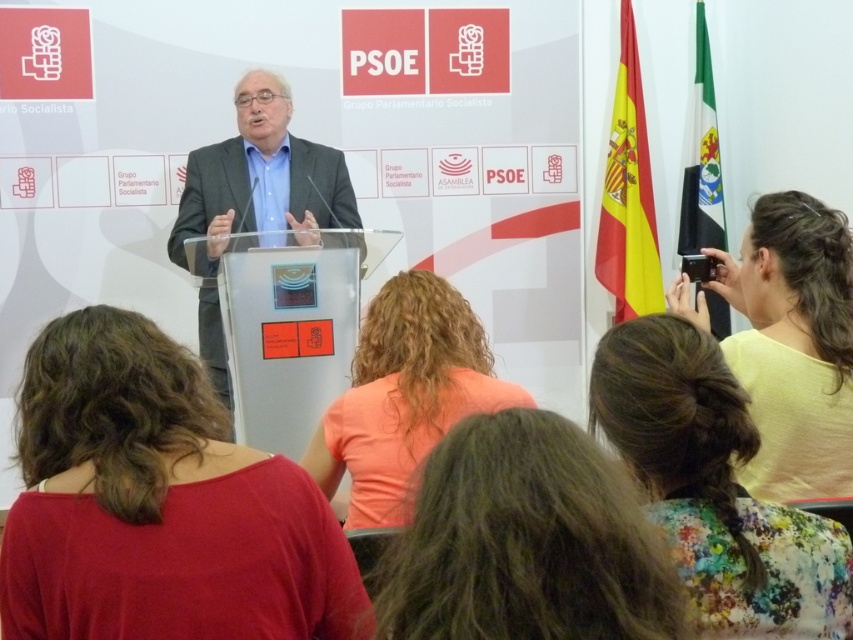
Is dark gray suit at center to the left of green fabric flag at right from the viewer's perspective?

Yes, dark gray suit at center is to the left of green fabric flag at right.

Does dark gray suit at center have a larger size compared to green fabric flag at right?

Indeed, dark gray suit at center has a larger size compared to green fabric flag at right.

Does point (268, 218) lie in front of point (697, 202)?

Yes, it is.

Find the location of a particular element. dark gray suit at center is located at coordinates (260, 173).

Looking at this image, between matte red shirt at lower left and dark brown hair at center, which one is positioned lower?

matte red shirt at lower left is below.

Is point (194, 460) positioned after point (401, 540)?

Yes, it is behind point (401, 540).

In the scene shown: Who is more forward, [80,499] or [532,616]?

Positioned in front is point [532,616].

I want to click on matte red shirt at lower left, so click(x=158, y=504).

Is matte red shirt at lower left shorter than orange fabric shirt at center?

Yes.

Measure the distance between matte red shirt at lower left and camera.

matte red shirt at lower left is 1.08 meters from camera.

Find the location of a particular element. Image resolution: width=853 pixels, height=640 pixels. matte red shirt at lower left is located at coordinates tap(158, 504).